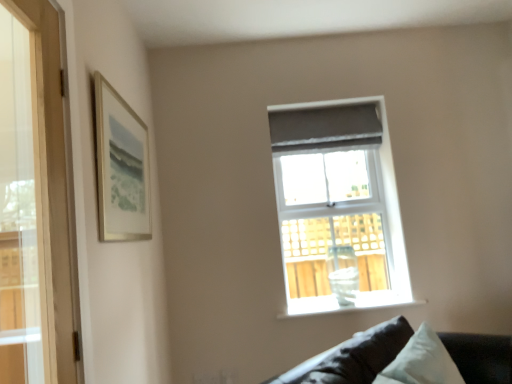
Where is `matte gray window at upper center`? The height and width of the screenshot is (384, 512). matte gray window at upper center is located at coordinates (338, 207).

Describe the element at coordinates (121, 167) in the screenshot. I see `matte silver picture frame at upper left` at that location.

The height and width of the screenshot is (384, 512). In order to click on dark gray fabric couch at lower right in this screenshot , I will do `click(353, 357)`.

Would you say matte silver picture frame at upper left is part of white glossy vase at center's contents?

Actually, matte silver picture frame at upper left is outside white glossy vase at center.

Considering the points (378, 297) and (106, 160), which point is behind, point (378, 297) or point (106, 160)?

The point (378, 297) is more distant.

From the image's perspective, which object appears higher, white glossy vase at center or matte silver picture frame at upper left?

matte silver picture frame at upper left appears higher in the image.

How far apart are white glossy vase at center and matte silver picture frame at upper left?

white glossy vase at center and matte silver picture frame at upper left are 4.34 feet apart from each other.

Between point (490, 357) and point (346, 143), which one is positioned behind?

The point (346, 143) is more distant.

Would you consider dark gray fabric couch at lower right to be distant from matte gray curtain at upper center?

Yes.

Could you tell me if dark gray fabric couch at lower right is facing matte gray curtain at upper center?

No.

Locate an element on the screen. This screenshot has height=384, width=512. studio couch that is under the matte gray curtain at upper center (from a real-world perspective) is located at coordinates (353, 357).

Is matte silver picture frame at upper left to the left or to the right of matte gray curtain at upper center in the image?

From the image, it's evident that matte silver picture frame at upper left is to the left of matte gray curtain at upper center.

Is matte silver picture frame at upper left placed right next to matte gray curtain at upper center?

There is a gap between matte silver picture frame at upper left and matte gray curtain at upper center.

Does point (118, 107) appear closer or farther from the camera than point (276, 116)?

Clearly, point (118, 107) is closer to the camera than point (276, 116).

Is matte silver picture frame at upper left facing towards matte gray curtain at upper center?

No.

Is matte gray curtain at upper center positioned far away from white glossy vase at center?

Yes, matte gray curtain at upper center and white glossy vase at center are quite far apart.

From a real-world perspective, is matte gray curtain at upper center physically located above or below white glossy vase at center?

Clearly, from a real-world perspective, matte gray curtain at upper center is above white glossy vase at center.

Which point is more forward, (333,114) or (377,293)?

The point (377,293) is in front.

Consider the image. Relative to white glossy vase at center, is matte gray curtain at upper center in front or behind?

In the image, matte gray curtain at upper center appears behind white glossy vase at center.

Who is shorter, matte gray window at upper center or white glossy vase at center?

white glossy vase at center.

From the image's perspective, is matte gray window at upper center above or below white glossy vase at center?

Based on their image positions, matte gray window at upper center is located above white glossy vase at center.

From a real-world perspective, who is located higher, matte gray window at upper center or white glossy vase at center?

matte gray window at upper center is physically above.

Can you confirm if matte gray window at upper center is wider than white glossy vase at center?

Indeed, matte gray window at upper center has a greater width compared to white glossy vase at center.

From the image's perspective, would you say matte gray window at upper center is shown under dark gray fabric couch at lower right?

Actually, matte gray window at upper center appears above dark gray fabric couch at lower right in the image.

Which is behind, matte gray window at upper center or dark gray fabric couch at lower right?

matte gray window at upper center is further from the camera.

Between matte gray window at upper center and dark gray fabric couch at lower right, which one has less height?

Standing shorter between the two is dark gray fabric couch at lower right.

Find the location of a particular element. The width and height of the screenshot is (512, 384). studio couch below the matte gray window at upper center (from the image's perspective) is located at coordinates (353, 357).

How far apart are dark gray fabric couch at lower right and matte silver picture frame at upper left?

dark gray fabric couch at lower right and matte silver picture frame at upper left are 3.67 feet apart.

Is dark gray fabric couch at lower right looking in the opposite direction of matte silver picture frame at upper left?

No, matte silver picture frame at upper left is not at the back of dark gray fabric couch at lower right.

Is dark gray fabric couch at lower right taller than matte silver picture frame at upper left?

No, dark gray fabric couch at lower right is not taller than matte silver picture frame at upper left.

Identify the location of picture frame located above the white glossy vase at center (from a real-world perspective). (121, 167).

Locate an element on the screen. studio couch in front of the matte gray curtain at upper center is located at coordinates (353, 357).

Considering their positions, is matte gray curtain at upper center positioned further to matte gray window at upper center than white glossy vase at center?

Among the two, white glossy vase at center is located further to matte gray window at upper center.

Looking at the image, which one is located further to matte gray curtain at upper center, matte gray window at upper center or white glossy vase at center?

white glossy vase at center lies further to matte gray curtain at upper center than the other object.

Which object lies further to the anchor point matte silver picture frame at upper left, white glossy vase at center or dark gray fabric couch at lower right?

The object further to matte silver picture frame at upper left is white glossy vase at center.

Looking at the image, which one is located closer to white glossy vase at center, matte silver picture frame at upper left or dark gray fabric couch at lower right?

dark gray fabric couch at lower right.

Estimate the real-world distances between objects in this image. Which object is closer to matte silver picture frame at upper left, matte gray window at upper center or white glossy vase at center?

matte gray window at upper center is closer to matte silver picture frame at upper left.

Estimate the real-world distances between objects in this image. Which object is further from white glossy vase at center, matte gray curtain at upper center or matte silver picture frame at upper left?

matte silver picture frame at upper left is further to white glossy vase at center.

When comparing their distances from white glossy vase at center, does matte gray curtain at upper center or matte gray window at upper center seem further?

The object further to white glossy vase at center is matte gray curtain at upper center.

Consider the image. From the image, which object appears to be farther from white glossy vase at center, matte silver picture frame at upper left or matte gray window at upper center?

matte silver picture frame at upper left lies further to white glossy vase at center than the other object.

Identify the location of window sill between dark gray fabric couch at lower right and matte gray window at upper center along the z-axis. (348, 306).

The image size is (512, 384). Find the location of `picture frame between dark gray fabric couch at lower right and white glossy vase at center from front to back`. picture frame between dark gray fabric couch at lower right and white glossy vase at center from front to back is located at coordinates (121, 167).

You are a GUI agent. You are given a task and a screenshot of the screen. Output one action in this format:
    pyautogui.click(x=<x>, y=<y>)
    Task: Click on the window sill between matte silver picture frame at upper left and matte gray curtain at upper center from front to back
    The height and width of the screenshot is (384, 512).
    Given the screenshot: What is the action you would take?
    pyautogui.click(x=348, y=306)

This screenshot has height=384, width=512. I want to click on window between dark gray fabric couch at lower right and matte gray curtain at upper center in the front-back direction, so point(338,207).